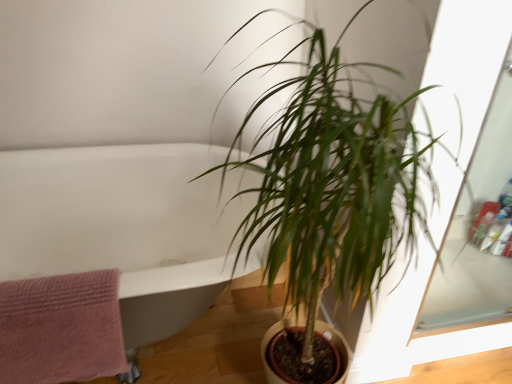
Question: From a real-world perspective, is white glossy bathtub at upper left positioned under green leafy plant at center based on gravity?

Choices:
 (A) yes
 (B) no

Answer: (A)

Question: Considering the relative sizes of white glossy bathtub at upper left and green leafy plant at center in the image provided, is white glossy bathtub at upper left shorter than green leafy plant at center?

Choices:
 (A) yes
 (B) no

Answer: (A)

Question: From the image's perspective, would you say white glossy bathtub at upper left is positioned over green leafy plant at center?

Choices:
 (A) yes
 (B) no

Answer: (B)

Question: Is white glossy bathtub at upper left wider than green leafy plant at center?

Choices:
 (A) yes
 (B) no

Answer: (A)

Question: Would you say white glossy bathtub at upper left contains green leafy plant at center?

Choices:
 (A) no
 (B) yes

Answer: (A)

Question: From a real-world perspective, is green leafy plant at center positioned above or below pink textured towel at left?

Choices:
 (A) above
 (B) below

Answer: (A)

Question: Is green leafy plant at center spatially inside pink textured towel at left, or outside of it?

Choices:
 (A) inside
 (B) outside

Answer: (B)

Question: Is green leafy plant at center to the left or to the right of pink textured towel at left in the image?

Choices:
 (A) right
 (B) left

Answer: (A)

Question: Looking at the image, does green leafy plant at center seem bigger or smaller compared to pink textured towel at left?

Choices:
 (A) big
 (B) small

Answer: (A)

Question: Considering the positions of pink textured towel at left and white glossy bathtub at upper left in the image, is pink textured towel at left bigger or smaller than white glossy bathtub at upper left?

Choices:
 (A) big
 (B) small

Answer: (B)

Question: Choose the correct answer: Is pink textured towel at left inside white glossy bathtub at upper left or outside it?

Choices:
 (A) inside
 (B) outside

Answer: (A)

Question: From a real-world perspective, is pink textured towel at left above or below white glossy bathtub at upper left?

Choices:
 (A) below
 (B) above

Answer: (B)

Question: Relative to white glossy bathtub at upper left, is pink textured towel at left in front or behind?

Choices:
 (A) front
 (B) behind

Answer: (B)

Question: In terms of size, does white glossy bathtub at upper left appear bigger or smaller than green leafy plant at center?

Choices:
 (A) small
 (B) big

Answer: (B)

Question: Considering the relative positions of white glossy bathtub at upper left and green leafy plant at center in the image provided, is white glossy bathtub at upper left to the left or to the right of green leafy plant at center?

Choices:
 (A) right
 (B) left

Answer: (B)